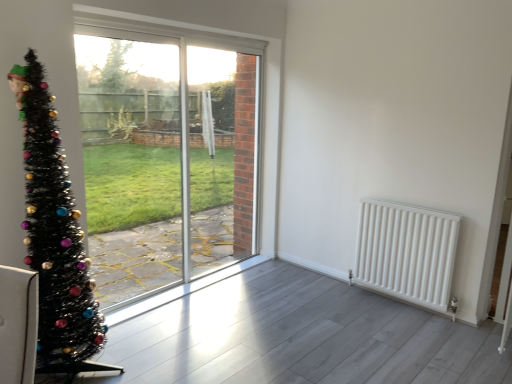
Question: Is white matte radiator at right positioned far away from transparent glass window at center?

Choices:
 (A) no
 (B) yes

Answer: (B)

Question: From a real-world perspective, does white matte radiator at right stand above transparent glass window at center?

Choices:
 (A) yes
 (B) no

Answer: (B)

Question: Is white matte radiator at right wider than transparent glass window at center?

Choices:
 (A) no
 (B) yes

Answer: (B)

Question: Is white matte radiator at right taller than transparent glass window at center?

Choices:
 (A) no
 (B) yes

Answer: (A)

Question: Could you tell me if white matte radiator at right is turned towards transparent glass window at center?

Choices:
 (A) yes
 (B) no

Answer: (B)

Question: Visually, is white matte radiator at right positioned to the left or to the right of black tinsel christmas tree at left?

Choices:
 (A) right
 (B) left

Answer: (A)

Question: Considering their positions, is white matte radiator at right located in front of or behind black tinsel christmas tree at left?

Choices:
 (A) behind
 (B) front

Answer: (A)

Question: Does point (359, 223) appear closer or farther from the camera than point (79, 334)?

Choices:
 (A) farther
 (B) closer

Answer: (A)

Question: In terms of size, does white matte radiator at right appear bigger or smaller than black tinsel christmas tree at left?

Choices:
 (A) small
 (B) big

Answer: (A)

Question: From the image's perspective, is transparent glass window at center positioned above or below clear glass screen door at center?

Choices:
 (A) above
 (B) below

Answer: (B)

Question: In the image, is transparent glass window at center on the left side or the right side of clear glass screen door at center?

Choices:
 (A) left
 (B) right

Answer: (A)

Question: Considering the positions of transparent glass window at center and clear glass screen door at center in the image, is transparent glass window at center taller or shorter than clear glass screen door at center?

Choices:
 (A) tall
 (B) short

Answer: (A)

Question: Is transparent glass window at center bigger or smaller than clear glass screen door at center?

Choices:
 (A) big
 (B) small

Answer: (A)

Question: In the image, is white matte radiator at right on the left side or the right side of clear glass screen door at center?

Choices:
 (A) right
 (B) left

Answer: (A)

Question: Considering the positions of white matte radiator at right and clear glass screen door at center in the image, is white matte radiator at right wider or thinner than clear glass screen door at center?

Choices:
 (A) wide
 (B) thin

Answer: (A)